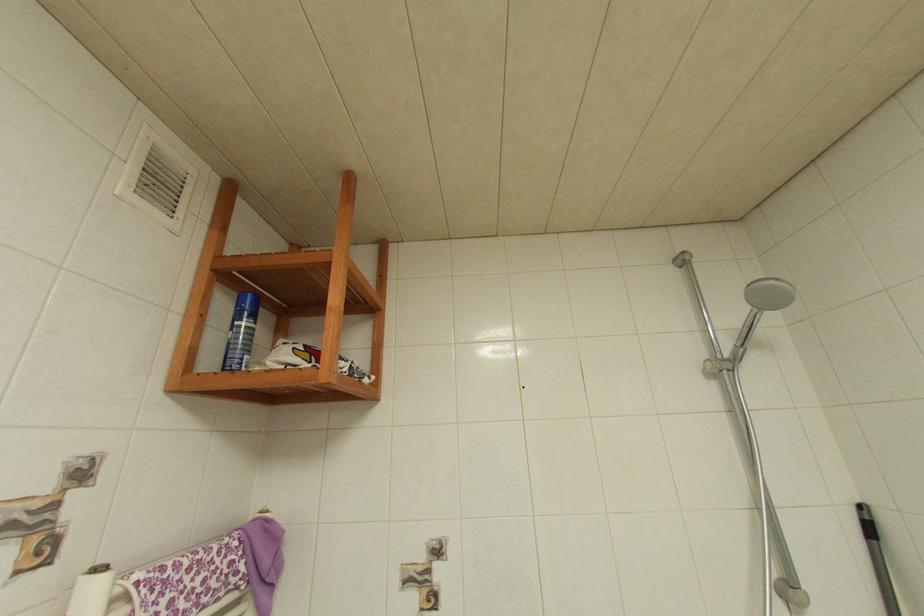
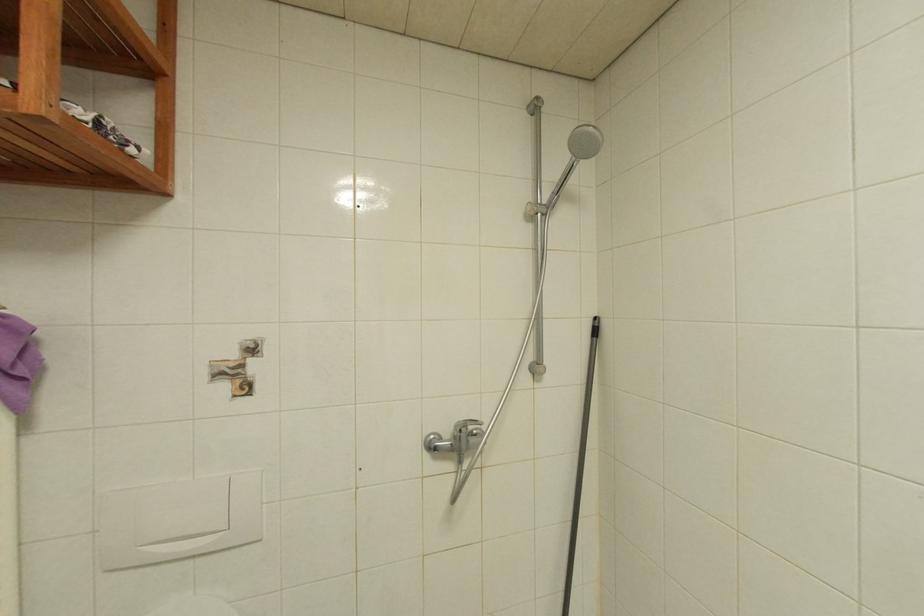
Based on the continuous images, in which direction is the camera rotating?

The camera rotated toward right-down.